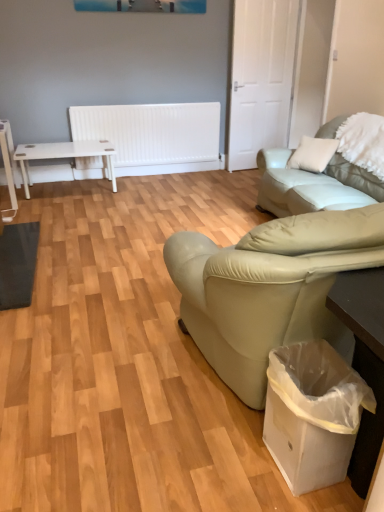
Question: From the image's perspective, is white plastic bag at lower right located beneath white fluffy pillow at upper right?

Choices:
 (A) yes
 (B) no

Answer: (A)

Question: Can you confirm if white plastic bag at lower right is bigger than white fluffy pillow at upper right?

Choices:
 (A) no
 (B) yes

Answer: (A)

Question: From a real-world perspective, is white plastic bag at lower right physically above white fluffy pillow at upper right?

Choices:
 (A) no
 (B) yes

Answer: (A)

Question: Is white plastic bag at lower right closer to camera compared to white fluffy pillow at upper right?

Choices:
 (A) no
 (B) yes

Answer: (B)

Question: Can white fluffy pillow at upper right be found inside white plastic bag at lower right?

Choices:
 (A) no
 (B) yes

Answer: (A)

Question: Can you confirm if white plastic bag at lower right is positioned to the left of white fluffy pillow at upper right?

Choices:
 (A) yes
 (B) no

Answer: (A)

Question: From a real-world perspective, is white fluffy pillow at upper right below leather couch at right?

Choices:
 (A) no
 (B) yes

Answer: (A)

Question: Is white fluffy pillow at upper right at the left side of leather couch at right?

Choices:
 (A) yes
 (B) no

Answer: (B)

Question: Considering the relative sizes of white fluffy pillow at upper right and leather couch at right in the image provided, is white fluffy pillow at upper right shorter than leather couch at right?

Choices:
 (A) no
 (B) yes

Answer: (B)

Question: Could leather couch at right be considered to be inside white fluffy pillow at upper right?

Choices:
 (A) yes
 (B) no

Answer: (B)

Question: Is white fluffy pillow at upper right bigger than leather couch at right?

Choices:
 (A) no
 (B) yes

Answer: (A)

Question: Is white fluffy pillow at upper right positioned beyond the bounds of leather couch at right?

Choices:
 (A) yes
 (B) no

Answer: (B)

Question: Is white fluffy pillow at upper right bigger than white plastic bag at lower right?

Choices:
 (A) no
 (B) yes

Answer: (B)